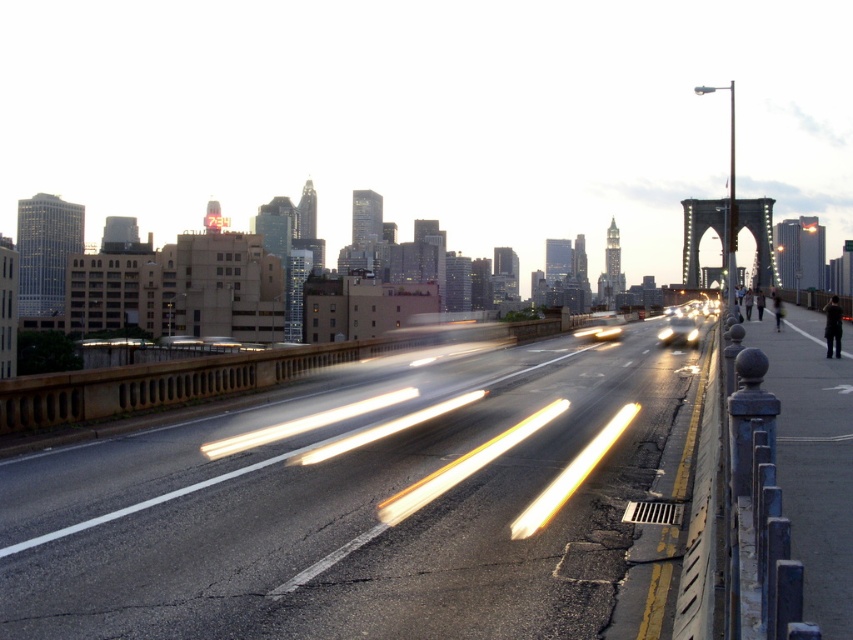
Question: Considering the relative positions of smooth asphalt highway at center and shiny silver sedan at center in the image provided, where is smooth asphalt highway at center located with respect to shiny silver sedan at center?

Choices:
 (A) above
 (B) below

Answer: (B)

Question: Which object appears farthest from the camera in this image?

Choices:
 (A) white glossy light at center
 (B) yellow translucent light at center
 (C) white light trails at center

Answer: (C)

Question: In this image, where is metallic gray bridge at right located relative to white light trails at center?

Choices:
 (A) below
 (B) above

Answer: (B)

Question: Based on their relative distances, which object is farther from the yellow translucent light at center?

Choices:
 (A) white glossy light at center
 (B) metallic gray bridge at right
 (C) shiny silver sedan at center
 (D) white light trails at center

Answer: (B)

Question: Is metallic gray bridge at right further to camera compared to yellow translucent light at center?

Choices:
 (A) yes
 (B) no

Answer: (A)

Question: Considering the real-world distances, which object is farthest from the metallic gray bridge at right?

Choices:
 (A) yellow/golden/stripes at center
 (B) shiny silver sedan at center
 (C) smooth concrete railing at right
 (D) white light trails at center

Answer: (D)